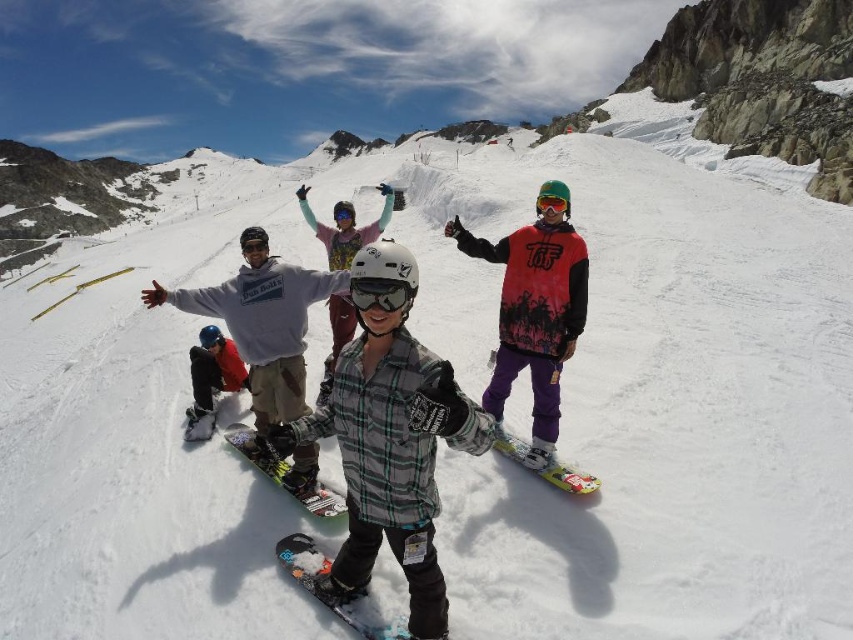
Question: Is brushed metal snowboard at center above black matte snowboard at lower left?

Choices:
 (A) yes
 (B) no

Answer: (B)

Question: Among these objects, which one is nearest to the camera?

Choices:
 (A) clear plastic goggles at center
 (B) green matte goggles at center
 (C) green plastic snowboard at center
 (D) black matte goggles at center

Answer: (A)

Question: Is brushed metal snowboard at center smaller than black matte goggles at center?

Choices:
 (A) yes
 (B) no

Answer: (B)

Question: Which object is the farthest from the green matte goggles at center?

Choices:
 (A) green plastic snowboard at center
 (B) plaid fabric snowboarder at center
 (C) black matte snowboard at lower left

Answer: (C)

Question: Does clear plastic goggles at center have a lesser width compared to black matte snowboard at lower left?

Choices:
 (A) yes
 (B) no

Answer: (B)

Question: Estimate the real-world distances between objects in this image. Which object is closer to the brushed metal snowboard at center?

Choices:
 (A) red matte jacket at center
 (B) matte black snowboard at lower left
 (C) black matte snowboard at lower left

Answer: (C)